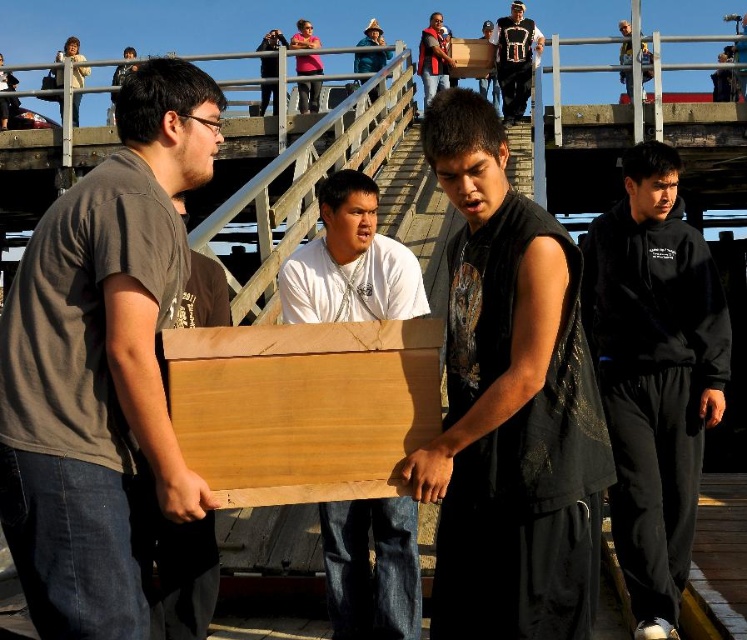
You are an observer standing on the wooden dock. You see the matte brown wood box at left and the light brown wood board at center. Which object takes up more space in the image?

The light brown wood board at center takes up more space in the image because the matte brown wood box at left occupies less space than light brown wood board at center.

You are a spectator standing on the wooden platform watching the group of men carrying objects. Which object is located below the other between the matte brown wood box at left and the light brown wood board at center?

The matte brown wood box at left is positioned under the light brown wood board at center.